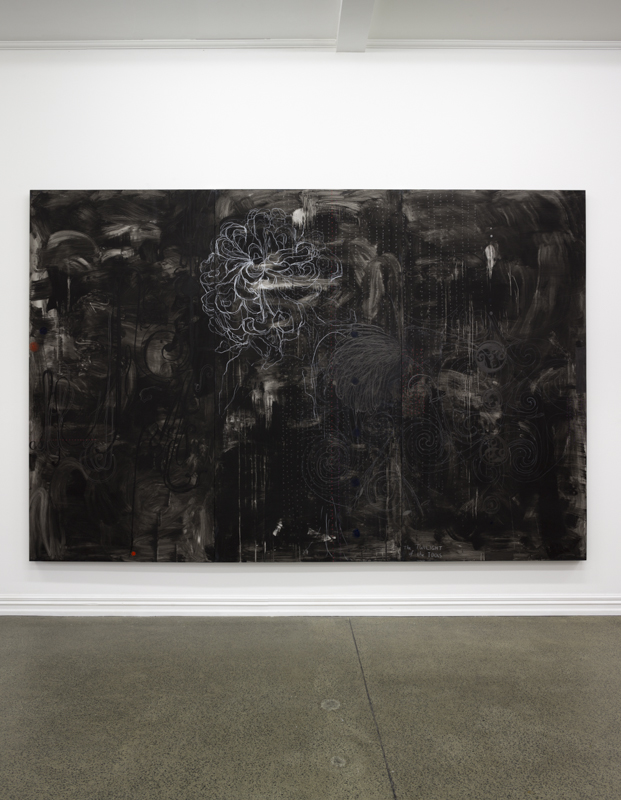
The width and height of the screenshot is (621, 800). I want to click on white baseboard under painting, so click(x=170, y=602).